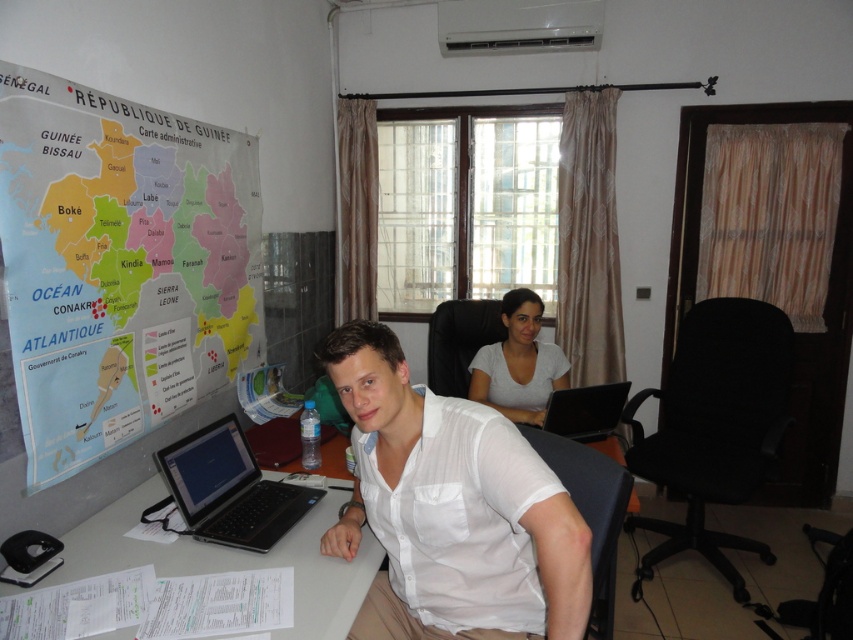
Question: Among these points, which one is farthest from the camera?

Choices:
 (A) (534, 401)
 (B) (772, 426)
 (C) (477, 449)

Answer: (A)

Question: In this image, where is paper map at left located relative to white matte shirt at center?

Choices:
 (A) left
 (B) right

Answer: (A)

Question: Which point is farther to the camera?

Choices:
 (A) pos(201,570)
 (B) pos(601,396)

Answer: (B)

Question: Which of these objects is positioned farthest from the paper map at left?

Choices:
 (A) black glossy laptop at center
 (B) white matte shirt at center
 (C) white plastic computer desk at center

Answer: (A)

Question: Where is white matte shirt at center located in relation to black fabric swivel chair at right in the image?

Choices:
 (A) below
 (B) above

Answer: (B)

Question: Is white matte shirt at center bigger than black glossy laptop at center?

Choices:
 (A) no
 (B) yes

Answer: (B)